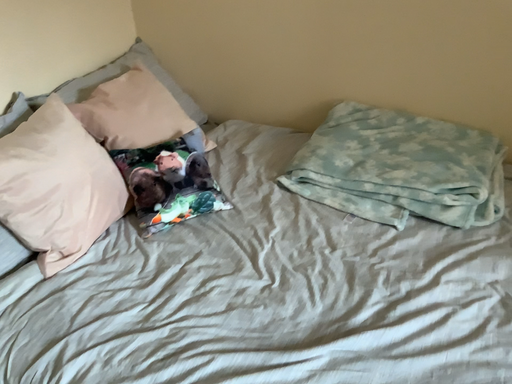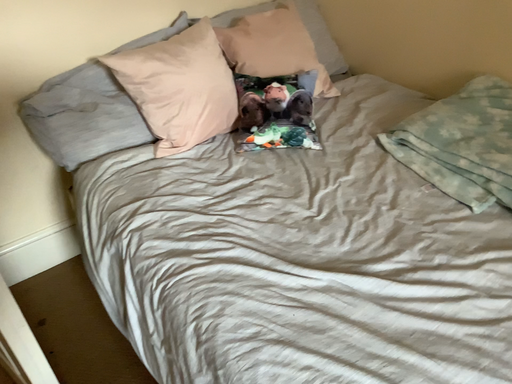
Question: Which way did the camera rotate in the video?

Choices:
 (A) rotated left
 (B) rotated right

Answer: (A)